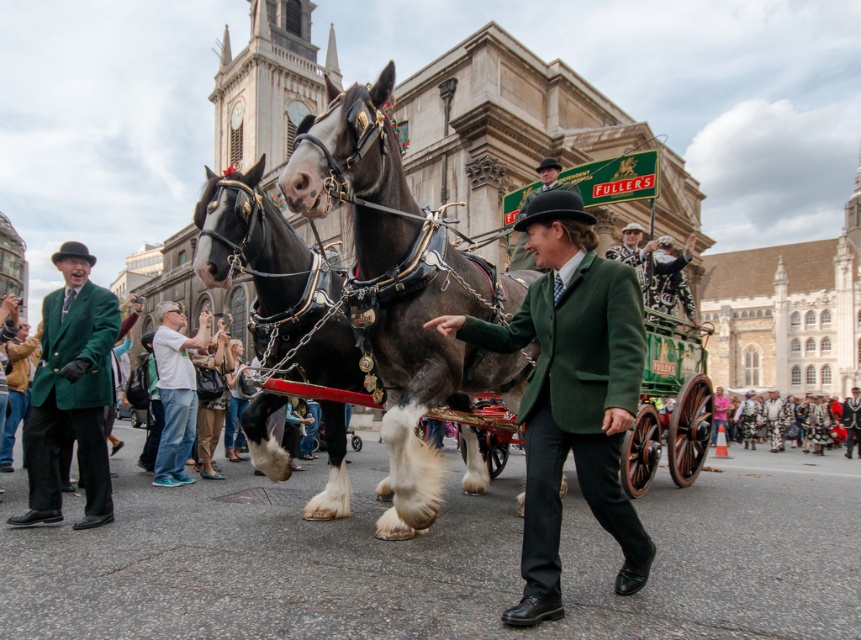
Between point (106, 346) and point (808, 416), which one is positioned in front?

Point (106, 346) is more forward.

Does green woolen blazer at left have a lesser width compared to floral-patterned fabric at lower right?

Correct, green woolen blazer at left's width is less than floral-patterned fabric at lower right's.

Between point (81, 474) and point (806, 442), which one is positioned behind?

The point (806, 442) is behind.

Identify the location of green woolen blazer at left. Image resolution: width=861 pixels, height=640 pixels. (71, 392).

Does shiny dark brown horse at center appear on the right side of patterned fabric hat at upper center?

In fact, shiny dark brown horse at center is to the left of patterned fabric hat at upper center.

Can you confirm if shiny dark brown horse at center is positioned below patterned fabric hat at upper center?

Yes.

Between point (350, 198) and point (633, 262), which one is positioned in front?

Point (350, 198)

Locate an element on the screen. shiny dark brown horse at center is located at coordinates (400, 291).

Is blue jeans at center to the right of patterned fabric hat at upper center from the viewer's perspective?

In fact, blue jeans at center is to the left of patterned fabric hat at upper center.

Is point (181, 362) farther from viewer compared to point (623, 227)?

No, it is not.

Find the location of a particular element. The image size is (861, 640). blue jeans at center is located at coordinates (177, 390).